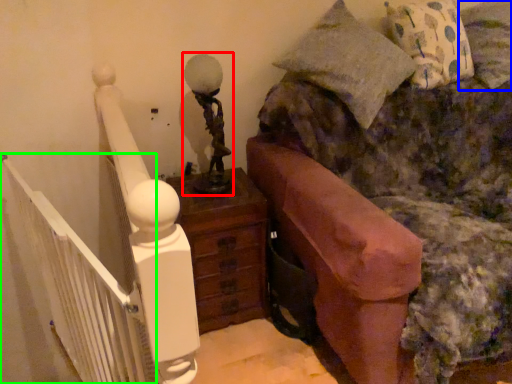
Question: Estimate the real-world distances between objects in this image. Which object is farther from table lamp (highlighted by a red box), pillow (highlighted by a blue box) or balustrade (highlighted by a green box)?

Choices:
 (A) pillow
 (B) balustrade

Answer: (A)